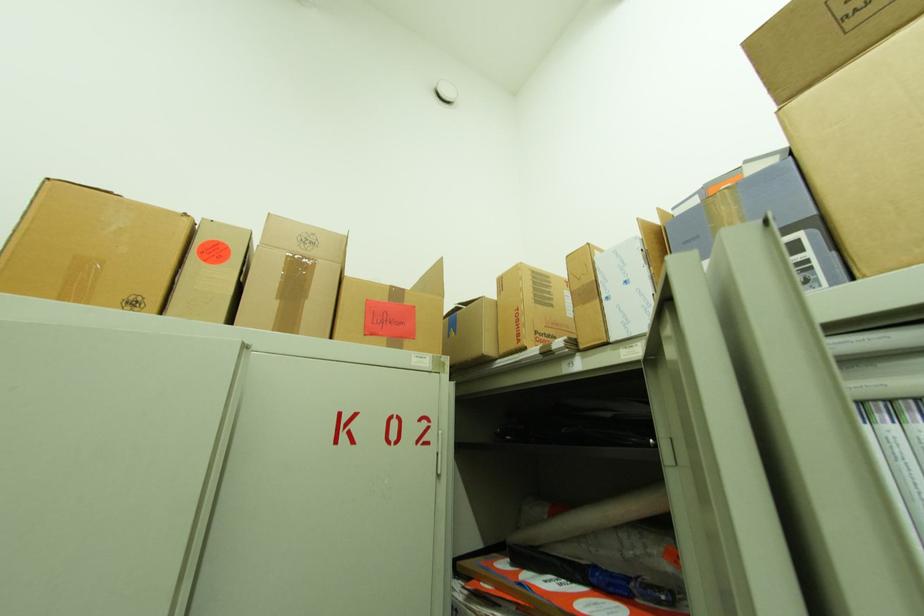
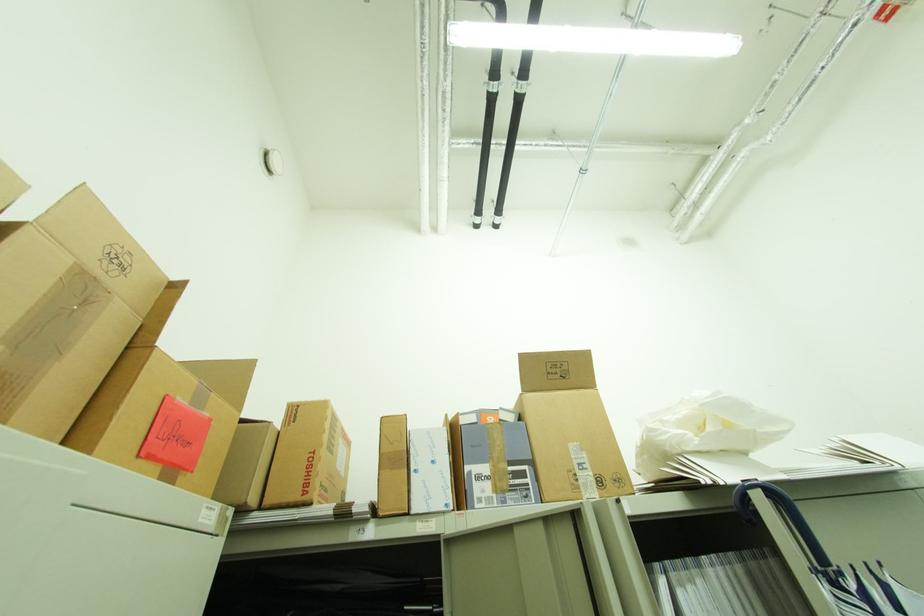
The images are taken continuously from a first-person perspective. In which direction is your viewpoint rotating?

The camera's rotation is toward right-up.